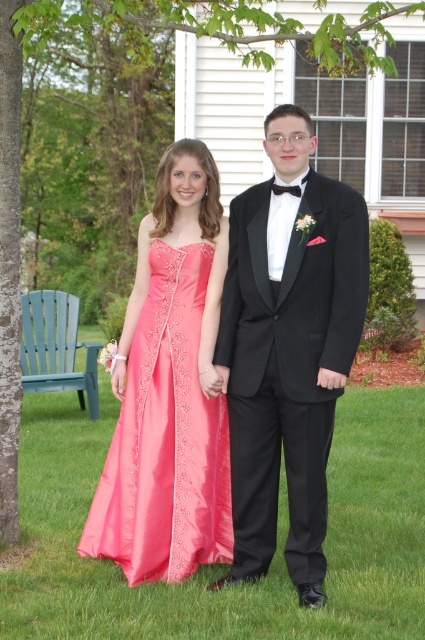
Question: Observing the image, what is the correct spatial positioning of black satin tuxedo at center in reference to shiny pink satin dress at center?

Choices:
 (A) right
 (B) left

Answer: (A)

Question: Which point is closer to the camera taking this photo?

Choices:
 (A) (178, 547)
 (B) (119, 634)
 (C) (357, 250)

Answer: (B)

Question: Is black satin tuxedo at center to the left of shiny pink satin dress at center from the viewer's perspective?

Choices:
 (A) no
 (B) yes

Answer: (A)

Question: From the image, what is the correct spatial relationship of green grass at center in relation to black satin tuxedo at center?

Choices:
 (A) above
 (B) below

Answer: (B)

Question: Which object is closer to the camera taking this photo?

Choices:
 (A) black satin tuxedo at center
 (B) shiny pink satin dress at center

Answer: (A)

Question: Which of these objects is positioned farthest from the shiny pink satin dress at center?

Choices:
 (A) black satin tuxedo at center
 (B) green grass at center

Answer: (B)